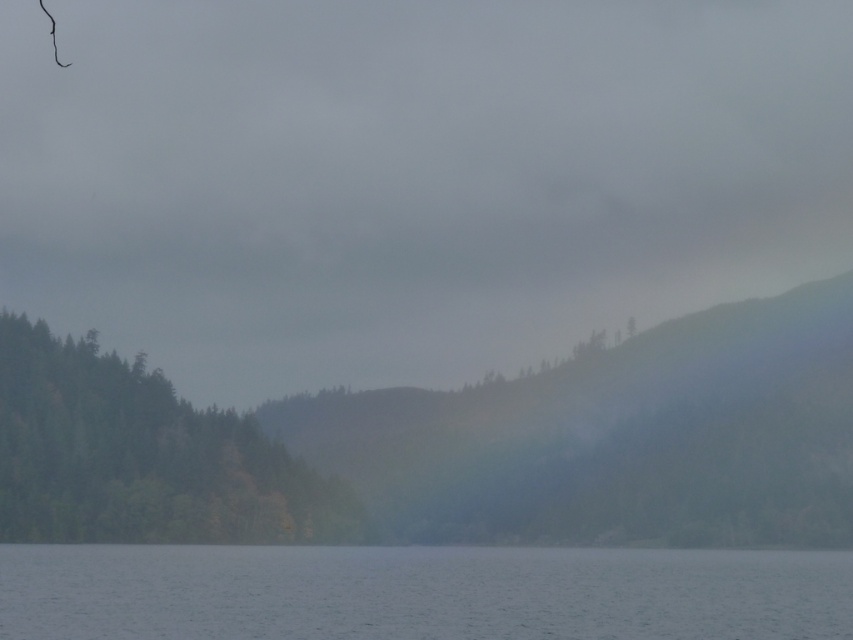
Based on the photo, you are standing at the edge of the water in the image and see two points marked in the scene. Which point, point (358, 620) or point (300, 536), is closer to you?

Point (358, 620) is closer to you because it is in front of point (300, 536).

You are an environmental scientist assessing the landscape. You need to determine which area covers more ground between the transparent water at lower center and the green matte forest at left. Based on the scene, which one is larger?

The transparent water at lower center has a larger size compared to the green matte forest at left, so the transparent water at lower center covers more ground.

You are standing at the edge of the scene and want to walk towards the transparent water at lower center. Which direction should you head relative to the green matte forest at left?

You should head towards the direction below the green matte forest at left since the transparent water at lower center is located below it.